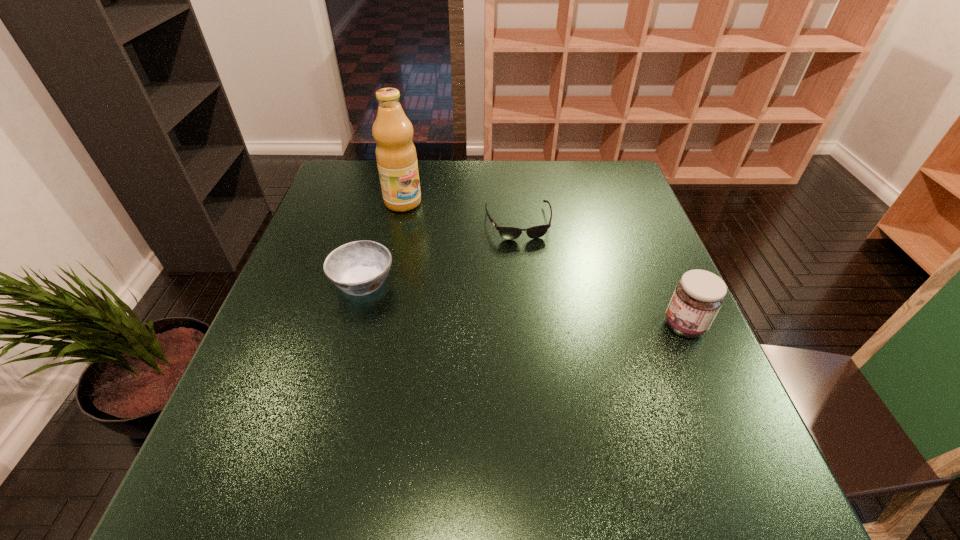
You are a GUI agent. You are given a task and a screenshot of the screen. Output one action in this format:
    pyautogui.click(x=<x>, y=<y>)
    Task: Click on the vacant space on the desktop that is between the second shortest object and the second tallest object and is positioned on the label of the olive oil
    The height and width of the screenshot is (540, 960).
    Given the screenshot: What is the action you would take?
    pyautogui.click(x=528, y=305)

You are a GUI agent. You are given a task and a screenshot of the screen. Output one action in this format:
    pyautogui.click(x=<x>, y=<y>)
    Task: Click on the vacant spot on the desktop that is between the second nearest object and the rightmost object and is positioned on the front-facing side of the sunglasses
    
    Given the screenshot: What is the action you would take?
    pyautogui.click(x=538, y=306)